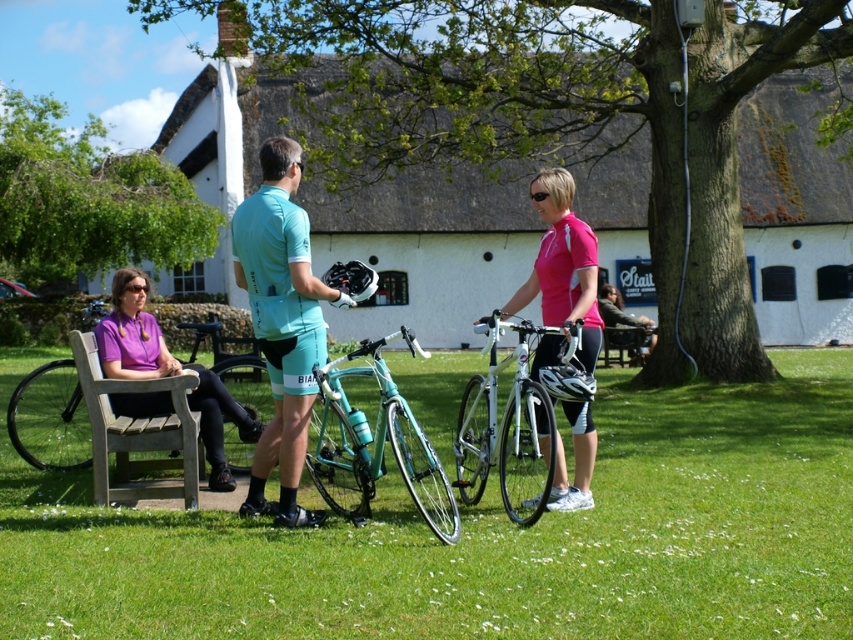
Question: Which point is farther to the camera?

Choices:
 (A) (352, 420)
 (B) (569, 310)
 (C) (576, 433)
 (D) (492, 312)

Answer: (D)

Question: Among these points, which one is nearest to the camera?

Choices:
 (A) (100, 339)
 (B) (529, 509)
 (C) (457, 432)

Answer: (B)

Question: Among these points, which one is nearest to the camera?

Choices:
 (A) (515, 310)
 (B) (204, 372)
 (C) (354, 440)
 (D) (299, 445)

Answer: (C)

Question: Considering the relative positions of matte teal bicycle at center and teal fabric jersey at center in the image provided, where is matte teal bicycle at center located with respect to teal fabric jersey at center?

Choices:
 (A) right
 (B) left

Answer: (A)

Question: Is white metallic bicycle at center behind wooden park bench at left?

Choices:
 (A) yes
 (B) no

Answer: (B)

Question: Is matte teal bicycle at center to the left of pink matte jersey at center from the viewer's perspective?

Choices:
 (A) no
 (B) yes

Answer: (B)